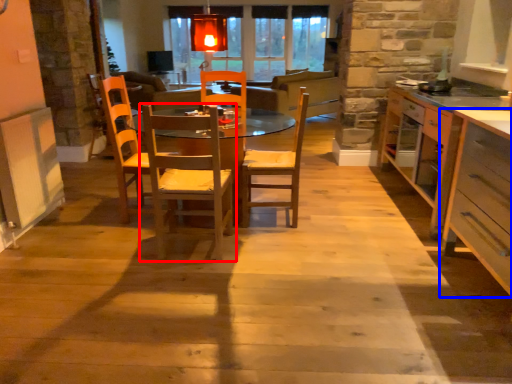
Question: Which of the following is the closest to the observer, chair (highlighted by a red box) or cabinetry (highlighted by a blue box)?

Choices:
 (A) chair
 (B) cabinetry

Answer: (B)